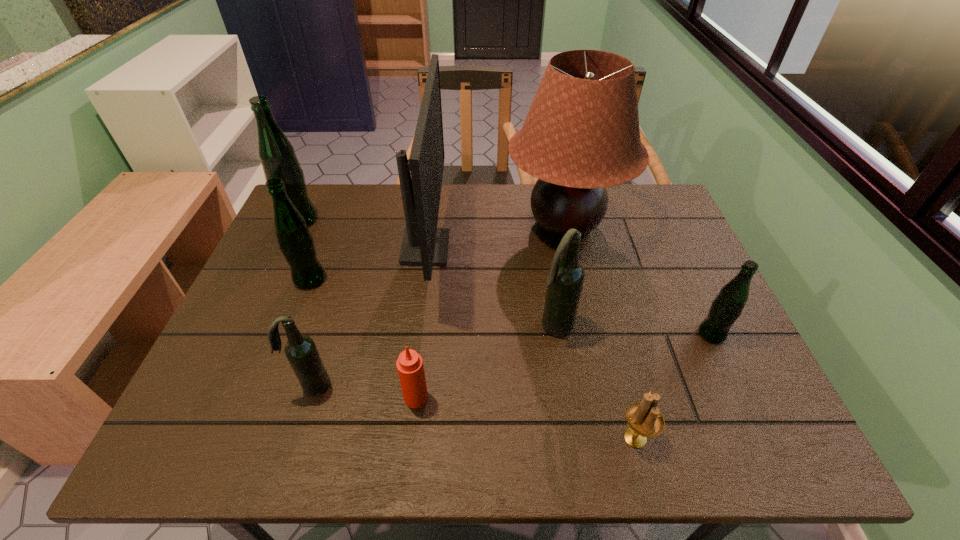
You are a GUI agent. You are given a task and a screenshot of the screen. Output one action in this format:
    pyautogui.click(x=<x>, y=<y>)
    Task: Click on the vacant area situated on the back of the second smallest green beer bottle
    The width and height of the screenshot is (960, 540).
    Given the screenshot: What is the action you would take?
    pyautogui.click(x=324, y=242)

Image resolution: width=960 pixels, height=540 pixels. In order to click on vacant space positioned on the front of the rightmost beer bottle in this screenshot , I will do [x=755, y=427].

Identify the location of vacant area located 0.050m on the front of the nearest beer bottle. The width and height of the screenshot is (960, 540). (301, 418).

At what (x,y) coordinates should I click in order to perform the action: click on vacant region located 0.170m on the left of the Tabasco sauce. Please return your answer as a coordinate pair (x, y). Looking at the image, I should click on (323, 397).

Find the location of a particular element. The width and height of the screenshot is (960, 540). vacant point located on the right of the nearest object is located at coordinates (679, 437).

Locate an element on the screen. lampshade present at the far edge is located at coordinates (581, 134).

Find the location of a particular element. computer monitor present at the far edge is located at coordinates (423, 244).

Image resolution: width=960 pixels, height=540 pixels. I want to click on beer bottle positioned at the far edge, so click(277, 155).

Identify the location of object that is positioned at the near edge. (644, 419).

The height and width of the screenshot is (540, 960). In order to click on lampshade that is at the right edge in this screenshot , I will do `click(581, 134)`.